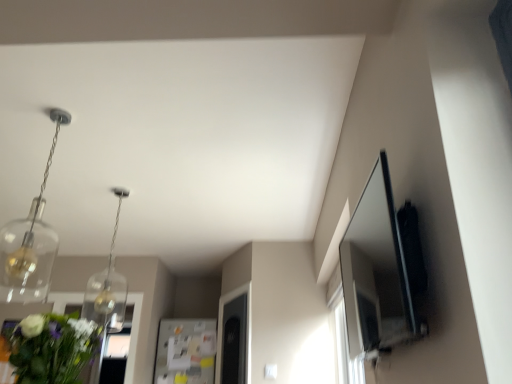
What do you see at coordinates (30, 242) in the screenshot?
I see `clear glass pendant at upper left, the 1th light fixture viewed from the front` at bounding box center [30, 242].

In order to face clear glass pendant light at upper left, marked as the 1th light fixture in a back-to-front arrangement, should I rotate leftwards or rightwards?

To align with it, rotate left about 18.939°.

This screenshot has height=384, width=512. In order to click on green leafy bouquet at lower left in this screenshot , I will do `click(51, 348)`.

From a real-world perspective, is clear glass pendant at upper left, acting as the second light fixture starting from the back, over green leafy bouquet at lower left?

Yes, from a real-world perspective, clear glass pendant at upper left, acting as the second light fixture starting from the back, is on top of green leafy bouquet at lower left.

Are clear glass pendant at upper left, the 1th light fixture viewed from the front, and green leafy bouquet at lower left beside each other?

No, clear glass pendant at upper left, the 1th light fixture viewed from the front, is not making contact with green leafy bouquet at lower left.

In terms of width, does clear glass pendant at upper left, acting as the second light fixture starting from the back, look wider or thinner when compared to green leafy bouquet at lower left?

clear glass pendant at upper left, acting as the second light fixture starting from the back, is thinner than green leafy bouquet at lower left.

Is clear glass pendant at upper left, acting as the second light fixture starting from the back, at the right side of green leafy bouquet at lower left?

In fact, clear glass pendant at upper left, acting as the second light fixture starting from the back, is to the left of green leafy bouquet at lower left.

Is clear glass pendant light at upper left, marked as the 1th light fixture in a back-to-front arrangement, aimed at green leafy bouquet at lower left?

No, clear glass pendant light at upper left, marked as the 1th light fixture in a back-to-front arrangement, is not turned towards green leafy bouquet at lower left.

Is green leafy bouquet at lower left completely or partially inside clear glass pendant light at upper left, the 2th light fixture positioned from the front?

No.

Is clear glass pendant light at upper left, marked as the 1th light fixture in a back-to-front arrangement, to the right of green leafy bouquet at lower left from the viewer's perspective?

No, clear glass pendant light at upper left, marked as the 1th light fixture in a back-to-front arrangement, is not to the right of green leafy bouquet at lower left.

Is clear glass pendant at upper left, acting as the second light fixture starting from the back, not inside clear glass pendant light at upper left, the 2th light fixture positioned from the front?

Yes.

From the image's perspective, which is above, clear glass pendant at upper left, the 1th light fixture viewed from the front, or clear glass pendant light at upper left, the 2th light fixture positioned from the front?

From the image's view, clear glass pendant at upper left, the 1th light fixture viewed from the front, is above.

Does clear glass pendant at upper left, the 1th light fixture viewed from the front, touch clear glass pendant light at upper left, marked as the 1th light fixture in a back-to-front arrangement?

They are not placed beside each other.

Relative to clear glass pendant light at upper left, the 2th light fixture positioned from the front, is green leafy bouquet at lower left in front or behind?

In the image, green leafy bouquet at lower left appears in front of clear glass pendant light at upper left, the 2th light fixture positioned from the front.

Considering the points (42, 363) and (88, 311), which point is in front, point (42, 363) or point (88, 311)?

The point (42, 363) is more forward.

Are green leafy bouquet at lower left and clear glass pendant light at upper left, the 2th light fixture positioned from the front, far apart?

Indeed, green leafy bouquet at lower left is not near clear glass pendant light at upper left, the 2th light fixture positioned from the front.

Find the location of a particular element. the 1st light fixture to the left of the green leafy bouquet at lower left, counting from the anchor's position is located at coordinates (106, 287).

From the image's perspective, would you say green leafy bouquet at lower left is positioned over clear glass pendant at upper left, acting as the second light fixture starting from the back?

Incorrect, from the image's perspective, green leafy bouquet at lower left is lower than clear glass pendant at upper left, acting as the second light fixture starting from the back.

Is green leafy bouquet at lower left outside of clear glass pendant at upper left, acting as the second light fixture starting from the back?

green leafy bouquet at lower left lies outside clear glass pendant at upper left, acting as the second light fixture starting from the back,'s area.

Between green leafy bouquet at lower left and clear glass pendant at upper left, acting as the second light fixture starting from the back, which one appears on the right side from the viewer's perspective?

Positioned to the right is green leafy bouquet at lower left.

From a real-world perspective, which object rests below the other?

green leafy bouquet at lower left.

Does point (118, 326) come in front of point (13, 259)?

Yes, it is in front of point (13, 259).

Is clear glass pendant light at upper left, the 2th light fixture positioned from the front, positioned beyond the bounds of clear glass pendant at upper left, acting as the second light fixture starting from the back?

clear glass pendant light at upper left, the 2th light fixture positioned from the front, is positioned outside clear glass pendant at upper left, acting as the second light fixture starting from the back.

Locate an element on the screen. This screenshot has width=512, height=384. light fixture on the left of the clear glass pendant light at upper left, the 2th light fixture positioned from the front is located at coordinates (30, 242).

Considering the positions of objects clear glass pendant light at upper left, marked as the 1th light fixture in a back-to-front arrangement, and clear glass pendant at upper left, the 1th light fixture viewed from the front, in the image provided, who is in front, clear glass pendant light at upper left, marked as the 1th light fixture in a back-to-front arrangement, or clear glass pendant at upper left, the 1th light fixture viewed from the front,?

clear glass pendant at upper left, the 1th light fixture viewed from the front.

Where is `the 2nd light fixture positioned above the green leafy bouquet at lower left (from the image's perspective)`? the 2nd light fixture positioned above the green leafy bouquet at lower left (from the image's perspective) is located at coordinates (30, 242).

What are the coordinates of `light fixture that is the 1st object above the green leafy bouquet at lower left (from a real-world perspective)` in the screenshot? It's located at (106, 287).

Based on their spatial positions, is clear glass pendant light at upper left, marked as the 1th light fixture in a back-to-front arrangement, or clear glass pendant at upper left, acting as the second light fixture starting from the back, further from green leafy bouquet at lower left?

clear glass pendant light at upper left, marked as the 1th light fixture in a back-to-front arrangement.

Which object lies nearer to the anchor point clear glass pendant light at upper left, the 2th light fixture positioned from the front, clear glass pendant at upper left, the 1th light fixture viewed from the front, or green leafy bouquet at lower left?

clear glass pendant at upper left, the 1th light fixture viewed from the front, is closer to clear glass pendant light at upper left, the 2th light fixture positioned from the front.

Consider the image. Looking at the image, which one is located closer to clear glass pendant light at upper left, the 2th light fixture positioned from the front, green leafy bouquet at lower left or clear glass pendant at upper left, acting as the second light fixture starting from the back?

clear glass pendant at upper left, acting as the second light fixture starting from the back, is positioned closer to the anchor clear glass pendant light at upper left, the 2th light fixture positioned from the front.

Considering their positions, is clear glass pendant at upper left, acting as the second light fixture starting from the back, positioned further to green leafy bouquet at lower left than clear glass pendant light at upper left, the 2th light fixture positioned from the front?

Based on the image, clear glass pendant light at upper left, the 2th light fixture positioned from the front, appears to be further to green leafy bouquet at lower left.

Looking at the image, which one is located further to clear glass pendant at upper left, the 1th light fixture viewed from the front, clear glass pendant light at upper left, marked as the 1th light fixture in a back-to-front arrangement, or green leafy bouquet at lower left?

green leafy bouquet at lower left.

When comparing their distances from clear glass pendant at upper left, the 1th light fixture viewed from the front, does green leafy bouquet at lower left or clear glass pendant light at upper left, the 2th light fixture positioned from the front, seem closer?

clear glass pendant light at upper left, the 2th light fixture positioned from the front, is positioned closer to the anchor clear glass pendant at upper left, the 1th light fixture viewed from the front.

Where is `light fixture positioned between green leafy bouquet at lower left and clear glass pendant light at upper left, marked as the 1th light fixture in a back-to-front arrangement, from near to far`? The width and height of the screenshot is (512, 384). light fixture positioned between green leafy bouquet at lower left and clear glass pendant light at upper left, marked as the 1th light fixture in a back-to-front arrangement, from near to far is located at coordinates (30, 242).